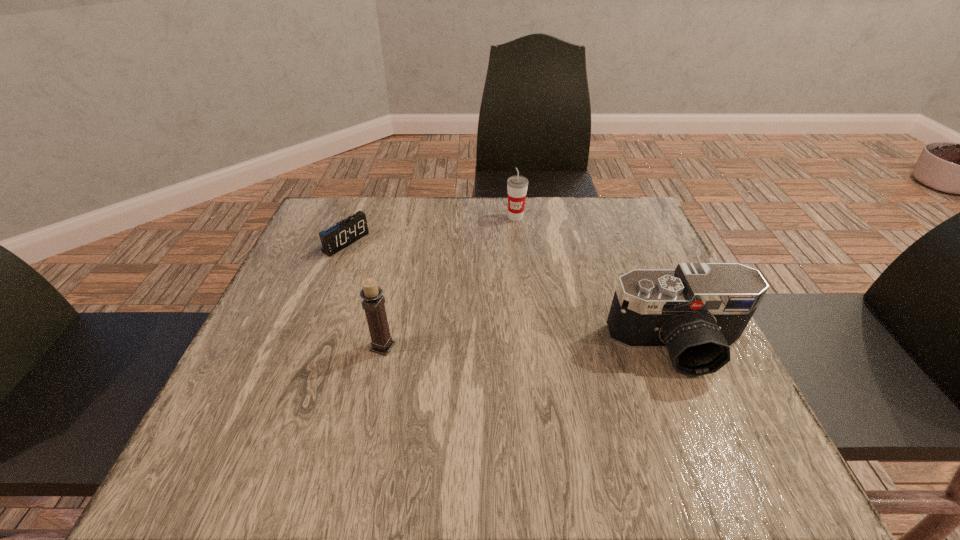
Where is `vacant space on the desktop that is between the candle holder and the camera and is positioned on the front-facing side of the leftmost object`? The width and height of the screenshot is (960, 540). vacant space on the desktop that is between the candle holder and the camera and is positioned on the front-facing side of the leftmost object is located at coordinates [530, 347].

You are a GUI agent. You are given a task and a screenshot of the screen. Output one action in this format:
    pyautogui.click(x=<x>, y=<y>)
    Task: Click on the free space on the desktop that is between the candle holder and the camera and is positioned on the side of the second object from right to left with the logo
    
    Given the screenshot: What is the action you would take?
    pyautogui.click(x=542, y=347)